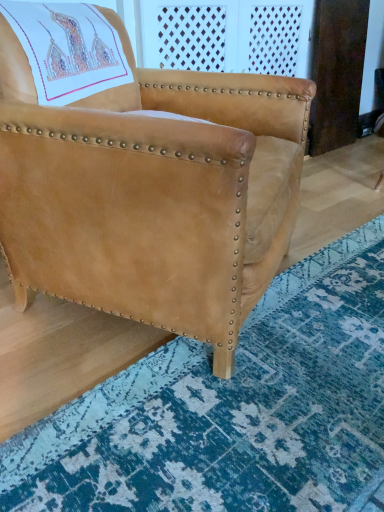
Find the location of a particular element. This screenshot has height=512, width=384. suede tan chair at center is located at coordinates (142, 176).

The image size is (384, 512). Describe the element at coordinates (142, 176) in the screenshot. I see `suede tan chair at center` at that location.

This screenshot has width=384, height=512. In order to click on blue textured rug at lower right in this screenshot , I will do `click(232, 410)`.

What do you see at coordinates (232, 410) in the screenshot?
I see `blue textured rug at lower right` at bounding box center [232, 410].

Locate an element on the screen. This screenshot has height=512, width=384. suede tan chair at center is located at coordinates (142, 176).

Looking at this image, would you say suede tan chair at center is to the left or to the right of blue textured rug at lower right in the picture?

suede tan chair at center is to the left of blue textured rug at lower right.

Is suede tan chair at center in front of or behind blue textured rug at lower right in the image?

In the image, suede tan chair at center appears behind blue textured rug at lower right.

Which is further, [209,283] or [354,360]?

Point [354,360]

Based on the photo, from the image's perspective, is suede tan chair at center below blue textured rug at lower right?

No, from the image's perspective, suede tan chair at center is not below blue textured rug at lower right.

From a real-world perspective, is suede tan chair at center on blue textured rug at lower right?

Indeed, from a real-world perspective, suede tan chair at center stands above blue textured rug at lower right.

Looking at their sizes, would you say suede tan chair at center is wider or thinner than blue textured rug at lower right?

Considering their sizes, suede tan chair at center looks slimmer than blue textured rug at lower right.

Is suede tan chair at center shorter than blue textured rug at lower right?

In fact, suede tan chair at center may be taller than blue textured rug at lower right.

Can you confirm if suede tan chair at center is smaller than blue textured rug at lower right?

No, suede tan chair at center is not smaller than blue textured rug at lower right.

Does suede tan chair at center contain blue textured rug at lower right?

No, suede tan chair at center does not contain blue textured rug at lower right.

Is suede tan chair at center placed right next to blue textured rug at lower right?

suede tan chair at center and blue textured rug at lower right are clearly separated.

Is suede tan chair at center oriented towards blue textured rug at lower right?

Yes, suede tan chair at center is aimed at blue textured rug at lower right.

How many degrees apart are the facing directions of suede tan chair at center and blue textured rug at lower right?

64.1 degrees separate the facing orientations of suede tan chair at center and blue textured rug at lower right.

Find the location of `mat that is below the suede tan chair at center (from the image's perspective)`. mat that is below the suede tan chair at center (from the image's perspective) is located at coordinates (232, 410).

Is blue textured rug at lower right at the left side of suede tan chair at center?

Incorrect, blue textured rug at lower right is not on the left side of suede tan chair at center.

Which object is closer to the camera, blue textured rug at lower right or suede tan chair at center?

blue textured rug at lower right.

Does point (120, 410) appear closer or farther from the camera than point (74, 116)?

Point (120, 410) appears to be farther away from the viewer than point (74, 116).

From the image's perspective, is blue textured rug at lower right below suede tan chair at center?

Yes, from the image's perspective, blue textured rug at lower right is beneath suede tan chair at center.

From a real-world perspective, between blue textured rug at lower right and suede tan chair at center, who is vertically higher?

From a 3D spatial view, suede tan chair at center is above.

Considering the relative sizes of blue textured rug at lower right and suede tan chair at center in the image provided, is blue textured rug at lower right thinner than suede tan chair at center?

No.

Considering the relative sizes of blue textured rug at lower right and suede tan chair at center in the image provided, is blue textured rug at lower right shorter than suede tan chair at center?

Yes.

Who is smaller, blue textured rug at lower right or suede tan chair at center?

blue textured rug at lower right.

Can suede tan chair at center be found inside blue textured rug at lower right?

Actually, suede tan chair at center is outside blue textured rug at lower right.

Is there a large distance between blue textured rug at lower right and suede tan chair at center?

blue textured rug at lower right is near suede tan chair at center, not far away.

Is blue textured rug at lower right turned away from suede tan chair at center?

No, suede tan chair at center is not at the back of blue textured rug at lower right.

Measure the distance between blue textured rug at lower right and suede tan chair at center.

blue textured rug at lower right and suede tan chair at center are 16.44 inches apart.

Find the location of a particular element. This screenshot has height=512, width=384. mat below the suede tan chair at center (from the image's perspective) is located at coordinates (232, 410).

In order to click on chair located on the left of blue textured rug at lower right in this screenshot , I will do `click(142, 176)`.

Locate an element on the screen. The width and height of the screenshot is (384, 512). chair located above the blue textured rug at lower right (from a real-world perspective) is located at coordinates (142, 176).